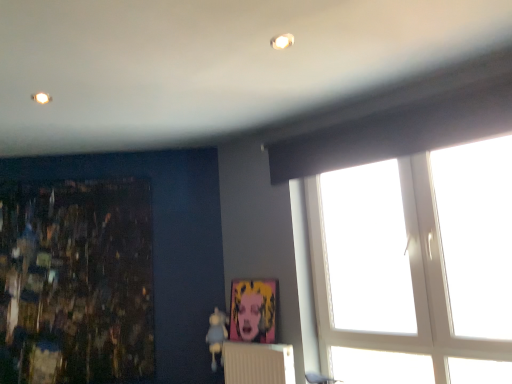
Identify the location of white plastic window at upper right. This screenshot has width=512, height=384. (408, 123).

What is the approximate height of matte plastic picture frame at center?

The height of matte plastic picture frame at center is 18.10 inches.

Find the location of a particular element. This screenshot has height=384, width=512. white plastic window at upper right is located at coordinates (408, 123).

From the image's perspective, is matte plastic picture frame at center over white textured radiator at lower center?

Correct, matte plastic picture frame at center appears higher than white textured radiator at lower center in the image.

Is white textured radiator at lower center surrounded by matte plastic picture frame at center?

That's incorrect, white textured radiator at lower center is not inside matte plastic picture frame at center.

Is matte plastic picture frame at center wider or thinner than white textured radiator at lower center?

In the image, matte plastic picture frame at center appears to be more narrow than white textured radiator at lower center.

Which of these two, dark textured painting at left or white textured radiator at lower center, is bigger?

dark textured painting at left.

From a real-world perspective, is dark textured painting at left on white textured radiator at lower center?

Yes, from a real-world perspective, dark textured painting at left is on top of white textured radiator at lower center.

Where is `radiator on the right of dark textured painting at left`? The width and height of the screenshot is (512, 384). radiator on the right of dark textured painting at left is located at coordinates (258, 363).

Is dark textured painting at left far away from white textured radiator at lower center?

dark textured painting at left is actually quite close to white textured radiator at lower center.

Is white plastic window at upper right surrounding matte plastic picture frame at center?

No, matte plastic picture frame at center is located outside of white plastic window at upper right.

From the image's perspective, between white plastic window at upper right and matte plastic picture frame at center, which one is located above?

white plastic window at upper right, from the image's perspective.

Based on the photo, based on their sizes in the image, would you say white plastic window at upper right is bigger or smaller than matte plastic picture frame at center?

Clearly, white plastic window at upper right is larger in size than matte plastic picture frame at center.

Are matte plastic picture frame at center and white plastic window at upper right making contact?

No, matte plastic picture frame at center is not beside white plastic window at upper right.

Considering the sizes of objects matte plastic picture frame at center and white plastic window at upper right in the image provided, who is shorter, matte plastic picture frame at center or white plastic window at upper right?

Standing shorter between the two is matte plastic picture frame at center.

Would you say matte plastic picture frame at center contains white plastic window at upper right?

No, white plastic window at upper right is not a part of matte plastic picture frame at center.

Relative to white textured radiator at lower center, is white plastic window at upper right in front or behind?

Visually, white plastic window at upper right is located in front of white textured radiator at lower center.

From a real-world perspective, which is physically above, white plastic window at upper right or white textured radiator at lower center?

In real-world perspective, white plastic window at upper right is above.

Measure the distance between white plastic window at upper right and white textured radiator at lower center.

white plastic window at upper right and white textured radiator at lower center are 1.29 meters apart.

Does point (411, 93) appear closer or farther from the camera than point (279, 361)?

Clearly, point (411, 93) is closer to the camera than point (279, 361).

Is white textured radiator at lower center in front of white plastic window at upper right?

No, it is behind white plastic window at upper right.

From the image's perspective, which one is positioned lower, white textured radiator at lower center or white plastic window at upper right?

white textured radiator at lower center is shown below in the image.

Where is `radiator below the white plastic window at upper right (from a real-world perspective)`? radiator below the white plastic window at upper right (from a real-world perspective) is located at coordinates (258, 363).

Is white textured radiator at lower center at the right side of white plastic window at upper right?

No.

From the image's perspective, is matte plastic picture frame at center on dark textured painting at left?

No, from the image's perspective, matte plastic picture frame at center is not on top of dark textured painting at left.

Between matte plastic picture frame at center and dark textured painting at left, which one has less height?

matte plastic picture frame at center is shorter.

The image size is (512, 384). I want to click on backdrop lying on the left of matte plastic picture frame at center, so click(166, 243).

Looking at their sizes, would you say matte plastic picture frame at center is wider or thinner than dark textured painting at left?

Considering their sizes, matte plastic picture frame at center looks broader than dark textured painting at left.

I want to click on picture frame lying on the left of white textured radiator at lower center, so click(253, 310).

Where is `radiator located underneath the dark textured painting at left (from a real-world perspective)`? The image size is (512, 384). radiator located underneath the dark textured painting at left (from a real-world perspective) is located at coordinates (258, 363).

From the image, which object appears to be farther from dark textured painting at left, white textured radiator at lower center or matte plastic picture frame at center?

The object further to dark textured painting at left is white textured radiator at lower center.

Estimate the real-world distances between objects in this image. Which object is further from matte plastic picture frame at center, dark textured painting at left or white plastic window at upper right?

Among the two, white plastic window at upper right is located further to matte plastic picture frame at center.

Which object lies nearer to the anchor point white textured radiator at lower center, dark textured painting at left or matte plastic picture frame at center?

matte plastic picture frame at center lies closer to white textured radiator at lower center than the other object.

Which object lies nearer to the anchor point white plastic window at upper right, dark textured painting at left or white textured radiator at lower center?

Based on the image, dark textured painting at left appears to be nearer to white plastic window at upper right.

Which object lies nearer to the anchor point white textured radiator at lower center, white plastic window at upper right or dark textured painting at left?

dark textured painting at left is closer to white textured radiator at lower center.

Which object lies nearer to the anchor point white textured radiator at lower center, white plastic window at upper right or matte plastic picture frame at center?

matte plastic picture frame at center is positioned closer to the anchor white textured radiator at lower center.

Based on their spatial positions, is white textured radiator at lower center or matte plastic picture frame at center closer to white plastic window at upper right?

Based on the image, matte plastic picture frame at center appears to be nearer to white plastic window at upper right.

Estimate the real-world distances between objects in this image. Which object is closer to white plastic window at upper right, matte plastic picture frame at center or white textured radiator at lower center?

matte plastic picture frame at center is positioned closer to the anchor white plastic window at upper right.

Locate an element on the screen. The height and width of the screenshot is (384, 512). radiator between dark textured painting at left and white plastic window at upper right from left to right is located at coordinates (258, 363).

The height and width of the screenshot is (384, 512). I want to click on picture frame located between dark textured painting at left and white textured radiator at lower center in the left-right direction, so click(253, 310).

Identify the location of radiator between matte plastic picture frame at center and white plastic window at upper right from left to right. Image resolution: width=512 pixels, height=384 pixels. (258, 363).

This screenshot has width=512, height=384. I want to click on picture frame located between dark textured painting at left and white plastic window at upper right in the left-right direction, so click(253, 310).